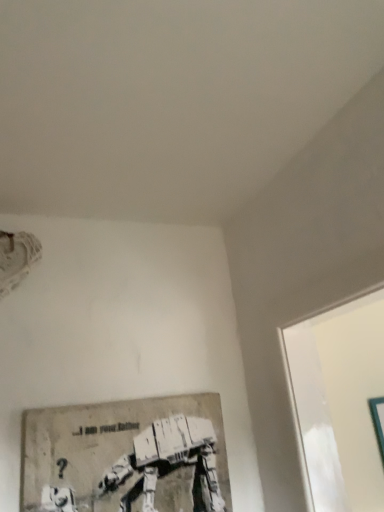
Question: Considering their positions, is matte gray poster at lower left, positioned as the second picture frame in back-to-front order, located in front of or behind teal glossy picture frame at right, arranged as the second picture frame when viewed from the left?

Choices:
 (A) front
 (B) behind

Answer: (A)

Question: From the image's perspective, is matte gray poster at lower left, which ranks as the first picture frame in left-to-right order, located above or below teal glossy picture frame at right, arranged as the second picture frame when viewed from the left?

Choices:
 (A) above
 (B) below

Answer: (A)

Question: Considering the positions of matte gray poster at lower left, acting as the 2th picture frame starting from the right, and teal glossy picture frame at right, positioned as the first picture frame in right-to-left order, in the image, is matte gray poster at lower left, acting as the 2th picture frame starting from the right, taller or shorter than teal glossy picture frame at right, positioned as the first picture frame in right-to-left order,?

Choices:
 (A) tall
 (B) short

Answer: (B)

Question: Based on their positions, is teal glossy picture frame at right, arranged as the second picture frame when viewed from the left, located to the left or right of matte gray poster at lower left, which is counted as the first picture frame, starting from the front?

Choices:
 (A) left
 (B) right

Answer: (B)

Question: Is teal glossy picture frame at right, positioned as the first picture frame in right-to-left order, spatially inside matte gray poster at lower left, which ranks as the first picture frame in left-to-right order, or outside of it?

Choices:
 (A) outside
 (B) inside

Answer: (A)

Question: Does point (375, 431) appear closer or farther from the camera than point (109, 415)?

Choices:
 (A) farther
 (B) closer

Answer: (A)

Question: Considering the positions of teal glossy picture frame at right, which appears as the 1th picture frame when viewed from the back, and matte gray poster at lower left, positioned as the second picture frame in back-to-front order, in the image, is teal glossy picture frame at right, which appears as the 1th picture frame when viewed from the back, wider or thinner than matte gray poster at lower left, positioned as the second picture frame in back-to-front order,?

Choices:
 (A) thin
 (B) wide

Answer: (A)